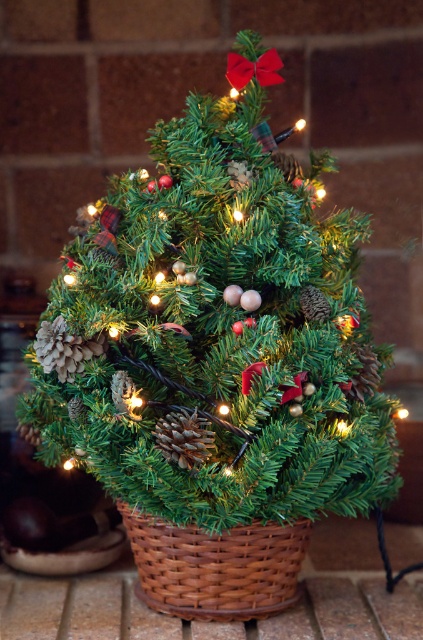
Does point (230, 602) come farther from viewer compared to point (164, 422)?

Yes.

Is point (283, 547) positioned behind point (200, 436)?

Yes, it is.

Where is `woven brown basket at center`? This screenshot has height=640, width=423. woven brown basket at center is located at coordinates (216, 566).

Which is more to the left, green matte christmas tree at center or woven brown basket at center?

Positioned to the left is green matte christmas tree at center.

Describe the element at coordinates (217, 328) in the screenshot. I see `green matte christmas tree at center` at that location.

Is point (153, 509) farther from viewer compared to point (277, 566)?

No, it is not.

The height and width of the screenshot is (640, 423). What are the coordinates of `green matte christmas tree at center` in the screenshot? It's located at (217, 328).

Can you confirm if green matte christmas tree at center is shorter than brown textured pine cone at center?

No, green matte christmas tree at center is not shorter than brown textured pine cone at center.

Is point (301, 336) closer to viewer compared to point (161, 428)?

That is False.

Which is behind, point (346, 452) or point (195, 435)?

Point (346, 452)

The height and width of the screenshot is (640, 423). I want to click on green matte christmas tree at center, so click(217, 328).